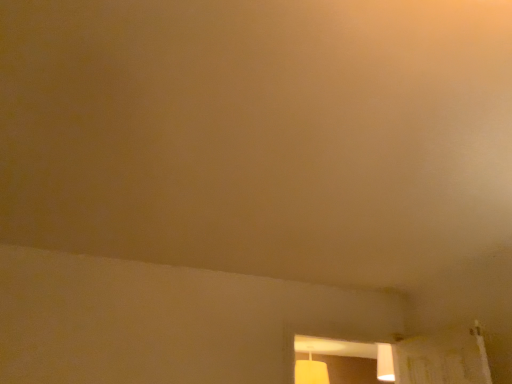
What do you see at coordinates (311, 372) in the screenshot?
I see `matte white lampshade at lower center` at bounding box center [311, 372].

At what (x,y) coordinates should I click in order to perform the action: click on matte white lampshade at lower center. Please return your answer as a coordinate pair (x, y). The width and height of the screenshot is (512, 384). Looking at the image, I should click on (311, 372).

Image resolution: width=512 pixels, height=384 pixels. Identify the location of matte white lampshade at lower center. (311, 372).